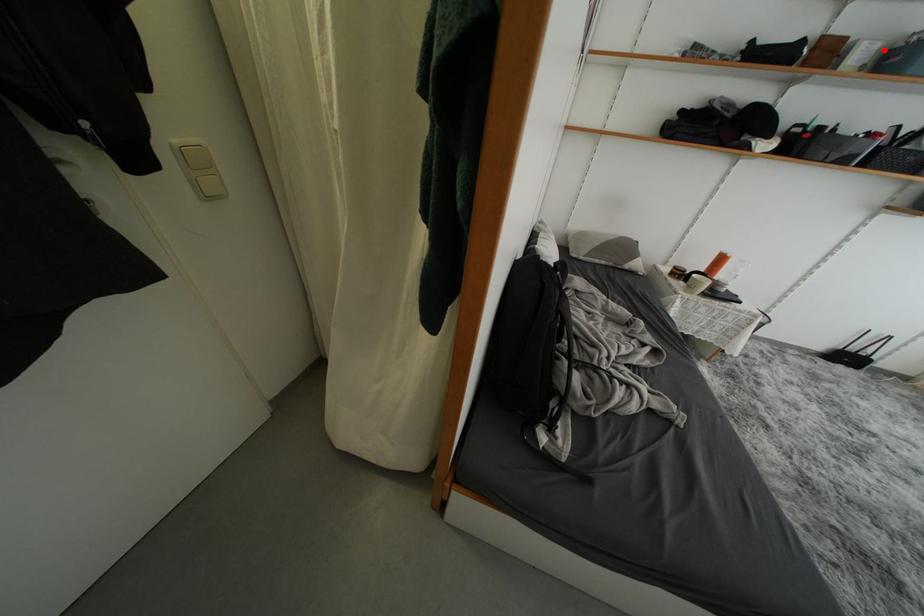
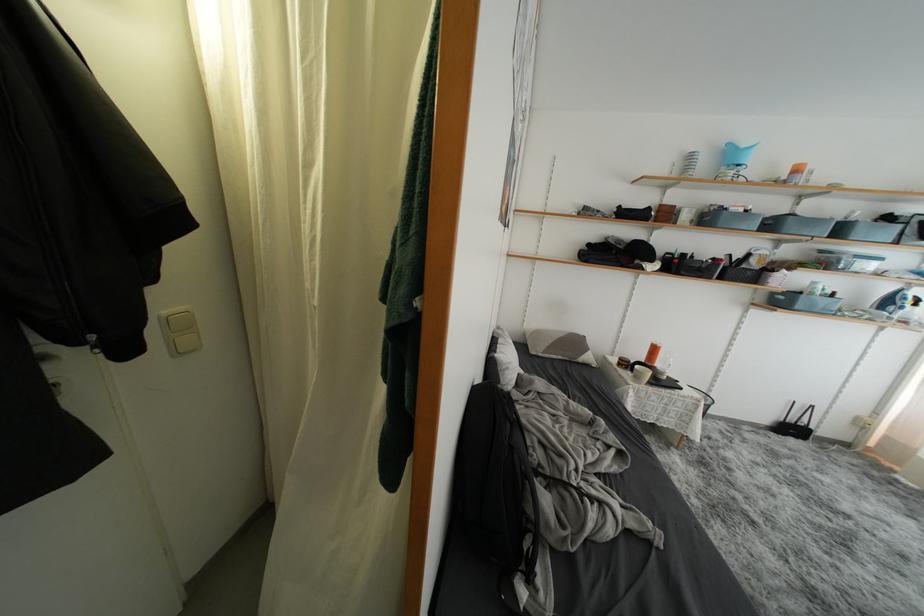
Question: A red point is marked in image1. In image2, is the corresponding 3D point closer to the camera or farther? Reply with the corresponding letter.

Choices:
 (A) The corresponding 3D point is closer.
 (B) The corresponding 3D point is farther.

Answer: (A)